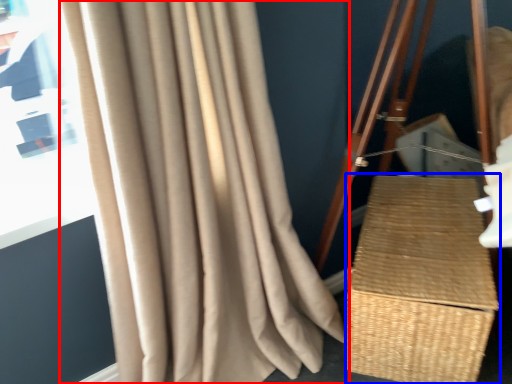
Question: Which point is closer to the camera, curtain (highlighted by a red box) or basket (highlighted by a blue box)?

Choices:
 (A) curtain
 (B) basket

Answer: (A)